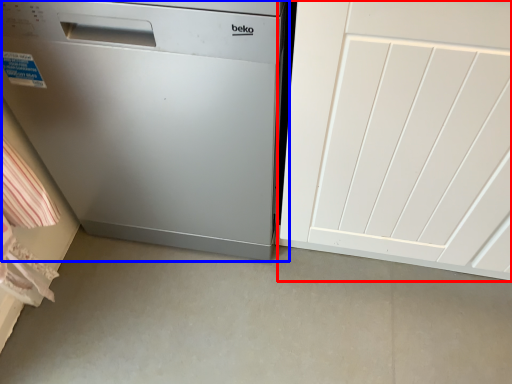
Question: Which object is closer to the camera taking this photo, door (highlighted by a red box) or home appliance (highlighted by a blue box)?

Choices:
 (A) door
 (B) home appliance

Answer: (A)